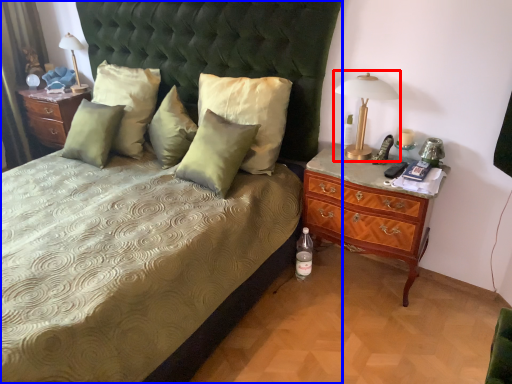
Question: Which of the following is the farthest to the observer, bedside lamp (highlighted by a red box) or bed (highlighted by a blue box)?

Choices:
 (A) bedside lamp
 (B) bed

Answer: (A)